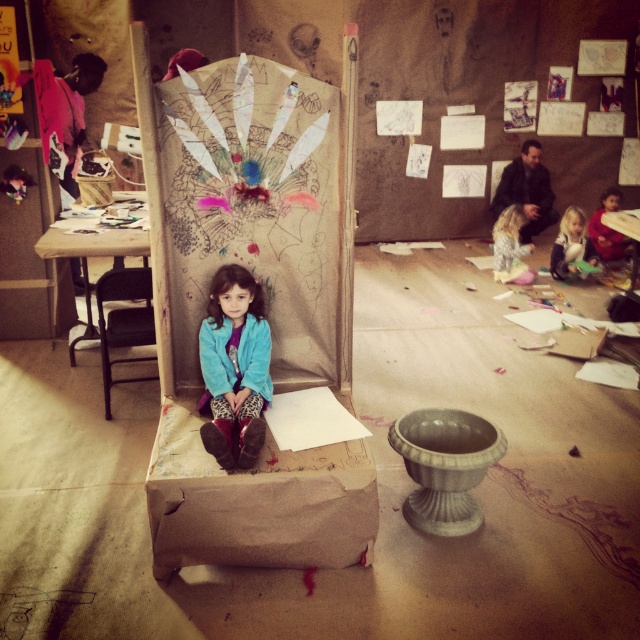
Does matte blue jacket at center appear on the right side of red velvet dress at lower right?

No, matte blue jacket at center is not to the right of red velvet dress at lower right.

Is point (260, 378) behind point (595, 230)?

That is False.

This screenshot has height=640, width=640. Identify the location of matte blue jacket at center. (234, 365).

Where is `matte blue jacket at center`? matte blue jacket at center is located at coordinates (234, 365).

Is point (532, 269) closer to camera compared to point (563, 240)?

No, (532, 269) is behind (563, 240).

Does fluffy gray sweater at lower right have a greater width compared to matte blue sweater at center?

Yes.

Is point (515, 204) positioned behind point (588, 248)?

That is True.

You are a GUI agent. You are given a task and a screenshot of the screen. Output one action in this format:
    pyautogui.click(x=<x>, y=<y>)
    Task: Click on the fluffy gray sweater at lower right
    The width and height of the screenshot is (640, 640).
    Given the screenshot: What is the action you would take?
    pyautogui.click(x=509, y=248)

Is the position of cardboard bulletin board at center less distant than that of red velvet dress at lower right?

Yes, it is.

Does cardboard bulletin board at center have a smaller size compared to red velvet dress at lower right?

No, cardboard bulletin board at center is not smaller than red velvet dress at lower right.

Is point (200, 132) more distant than point (589, 225)?

No, (200, 132) is in front of (589, 225).

You are a GUI agent. You are given a task and a screenshot of the screen. Output one action in this format:
    pyautogui.click(x=<x>, y=<y>)
    Task: Click on the cardboard bulletin board at center
    This screenshot has height=640, width=640.
    Given the screenshot: What is the action you would take?
    pyautogui.click(x=250, y=209)